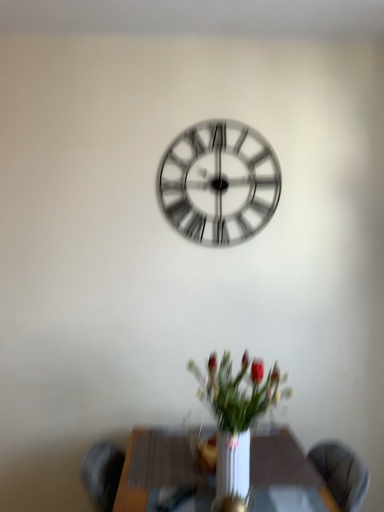
Question: Which is correct: white glossy vase at center is inside wooden table at center, or outside of it?

Choices:
 (A) outside
 (B) inside

Answer: (A)

Question: Looking at their shapes, would you say white glossy vase at center is wider or thinner than wooden table at center?

Choices:
 (A) thin
 (B) wide

Answer: (A)

Question: Which object is the farthest from the white glossy vase at center?

Choices:
 (A) metallic silver clock at center
 (B) wooden table at center

Answer: (A)

Question: Based on their relative distances, which object is farther from the metallic silver clock at center?

Choices:
 (A) wooden table at center
 (B) white glossy vase at center

Answer: (A)